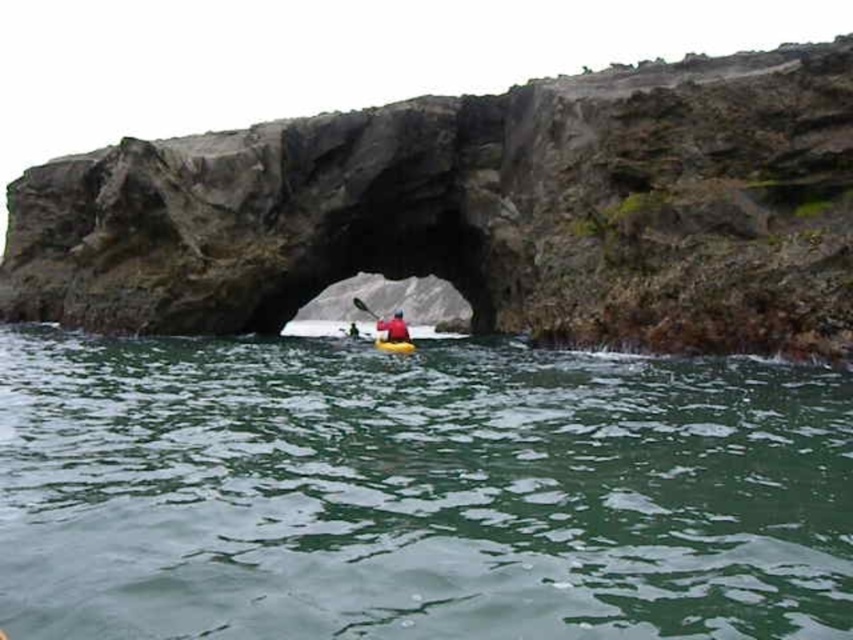
Question: Estimate the real-world distances between objects in this image. Which object is farther from the dark gray rocky arch at center?

Choices:
 (A) yellow plastic canoe at center
 (B) yellow kayak at center
 (C) red fabric kayak at center
 (D) yellow plastic paddle at center

Answer: (B)

Question: Is green water at center to the right of yellow plastic canoe at center from the viewer's perspective?

Choices:
 (A) yes
 (B) no

Answer: (B)

Question: Considering the relative positions of red fabric kayak at center and yellow plastic paddle at center in the image provided, where is red fabric kayak at center located with respect to yellow plastic paddle at center?

Choices:
 (A) left
 (B) right

Answer: (B)

Question: Which point appears closest to the camera in this image?

Choices:
 (A) (456, 472)
 (B) (352, 330)
 (C) (375, 348)

Answer: (A)

Question: Is dark gray rocky arch at center to the left of yellow plastic paddle at center from the viewer's perspective?

Choices:
 (A) yes
 (B) no

Answer: (B)

Question: Which point is farther to the camera?

Choices:
 (A) red fabric kayak at center
 (B) yellow kayak at center
 (C) yellow plastic canoe at center
 (D) dark gray rocky arch at center

Answer: (B)